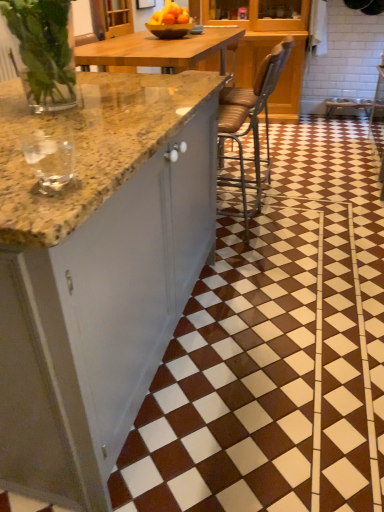
Question: In the image, is brown leather chair at center on the left side or the right side of clear glass wine glass at left?

Choices:
 (A) right
 (B) left

Answer: (A)

Question: Is point (241, 117) positioned closer to the camera than point (33, 132)?

Choices:
 (A) closer
 (B) farther

Answer: (B)

Question: Considering the real-world distances, which object is farthest from the brown glossy tile at center?

Choices:
 (A) brown leather chair at center
 (B) clear glass wine glass at left

Answer: (B)

Question: Estimate the real-world distances between objects in this image. Which object is closer to the brown glossy tile at center?

Choices:
 (A) brown leather chair at center
 (B) clear glass wine glass at left

Answer: (A)